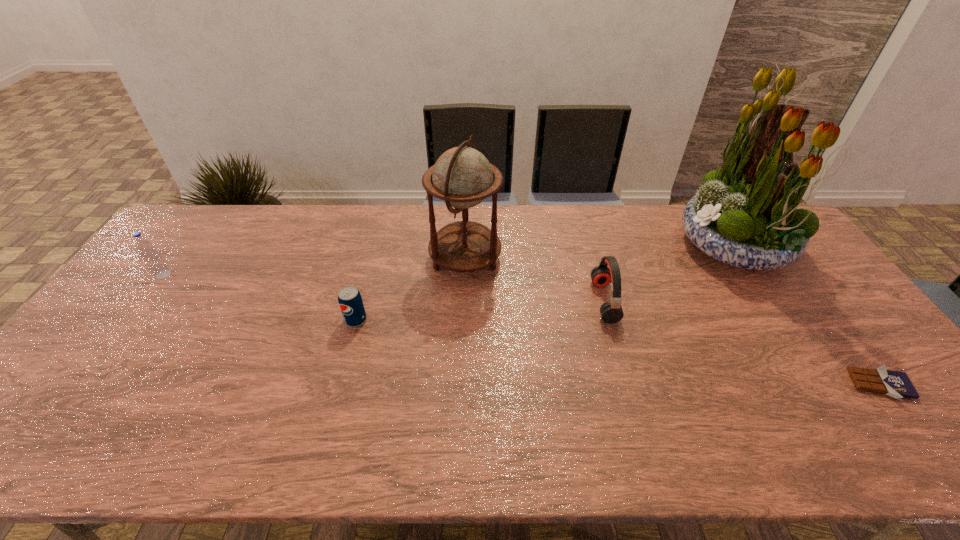
Where is `flower arrangement`? Image resolution: width=960 pixels, height=540 pixels. flower arrangement is located at coordinates (746, 215).

The height and width of the screenshot is (540, 960). Find the location of `globe`. globe is located at coordinates (462, 177).

The width and height of the screenshot is (960, 540). What are the coordinates of `the fifth shortest object` in the screenshot? It's located at (462, 177).

Identify the location of the leftmost object. This screenshot has width=960, height=540. (152, 258).

Find the location of a particular element. the third object from right to left is located at coordinates (611, 311).

Locate an element on the screen. The image size is (960, 540). pop is located at coordinates (350, 301).

Where is `the second object from left to right`? The height and width of the screenshot is (540, 960). the second object from left to right is located at coordinates (350, 301).

Where is `the nearest object`? The image size is (960, 540). the nearest object is located at coordinates (896, 384).

The image size is (960, 540). In order to click on the shortest object in this screenshot , I will do `click(896, 384)`.

Find the location of `vacant area situated 0.280m on the front-facing side of the tallest object`. vacant area situated 0.280m on the front-facing side of the tallest object is located at coordinates (595, 246).